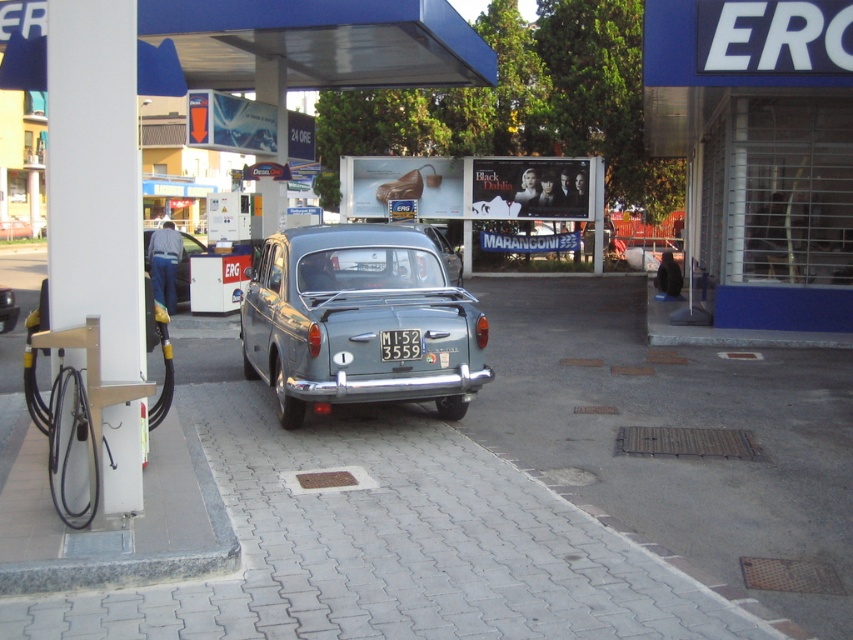
Question: Is white plastic license plate at center behind shiny metallic car at center?

Choices:
 (A) no
 (B) yes

Answer: (A)

Question: Which object is closer to the camera taking this photo?

Choices:
 (A) shiny metallic car at center
 (B) metallic gray sedan at center

Answer: (B)

Question: Is matte gray sedan at center below metallic gray sedan at center?

Choices:
 (A) yes
 (B) no

Answer: (A)

Question: Is metallic gray car at center to the right of matte gray sedan at center from the viewer's perspective?

Choices:
 (A) no
 (B) yes

Answer: (B)

Question: Which of the following is the farthest from the observer?

Choices:
 (A) metallic gray sedan at center
 (B) matte gray sedan at center

Answer: (B)

Question: Based on their relative distances, which object is farther from the white plastic license plate at center?

Choices:
 (A) shiny metallic car at center
 (B) metallic gray sedan at center

Answer: (A)